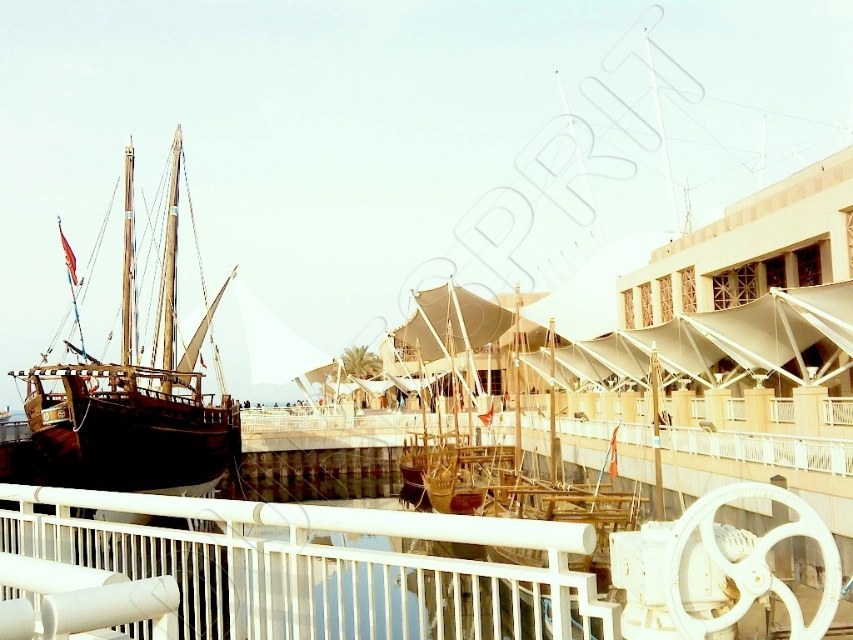
Question: Which point is farther to the camera?

Choices:
 (A) white metal fence at lower center
 (B) wooden sailboat at left
 (C) wooden sailboat at center

Answer: (C)

Question: Is white metal fence at lower center above wooden sailboat at left?

Choices:
 (A) no
 (B) yes

Answer: (A)

Question: Does white metal fence at lower center come in front of wooden sailboat at center?

Choices:
 (A) yes
 (B) no

Answer: (A)

Question: Which point is closer to the camera taking this photo?

Choices:
 (A) 76,428
 (B) 538,595

Answer: (B)

Question: Does wooden sailboat at left have a larger size compared to wooden sailboat at center?

Choices:
 (A) no
 (B) yes

Answer: (A)

Question: Which object is closer to the camera taking this photo?

Choices:
 (A) wooden sailboat at center
 (B) wooden sailboat at left
 (C) white metal fence at lower center

Answer: (C)